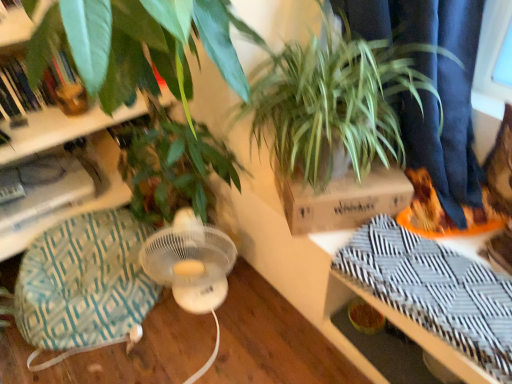
Find the location of `vacant space to the right of green woven swivel chair at lower left`. vacant space to the right of green woven swivel chair at lower left is located at coordinates (217, 334).